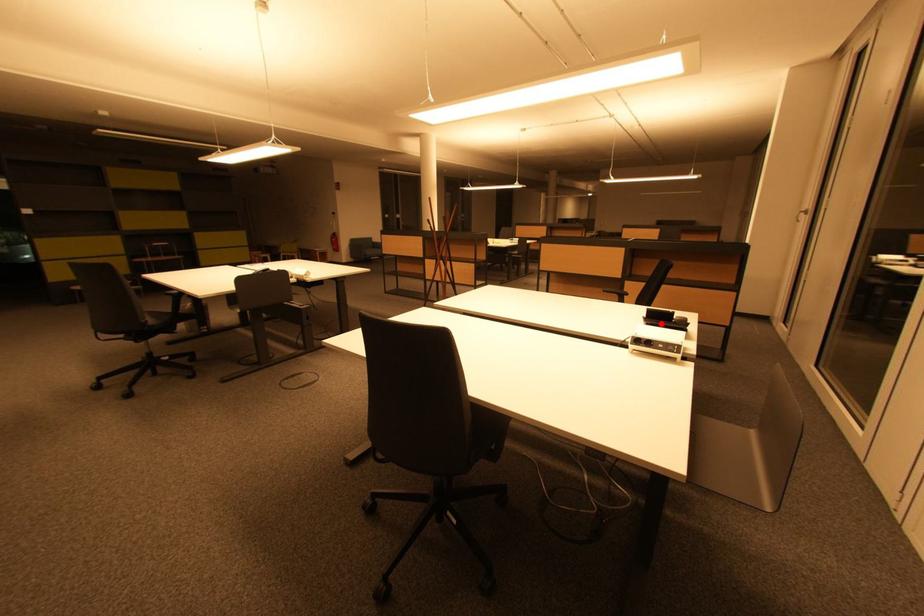
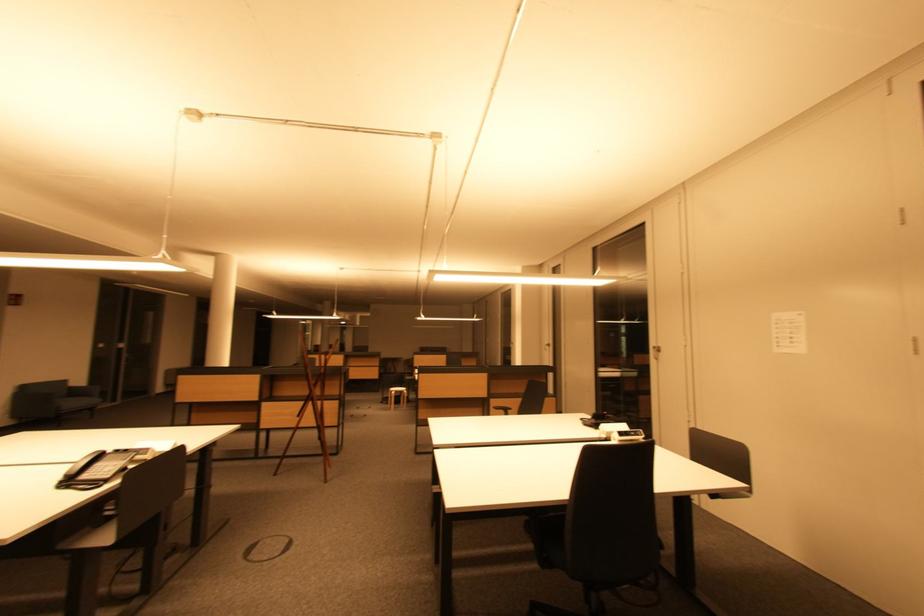
The point at the highlighted location is marked in the first image. Where is the corresponding point in the second image?

(606, 424)